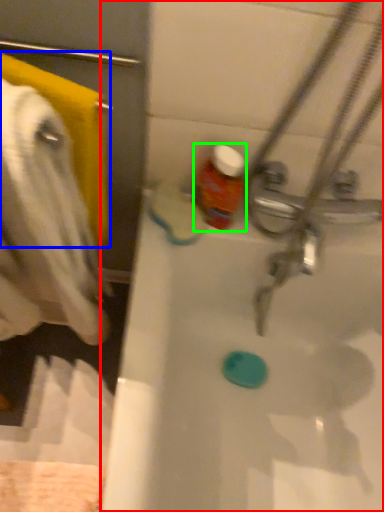
Question: Estimate the real-world distances between objects in this image. Which object is closer to bathtub (highlighted by a red box), towel/napkin (highlighted by a blue box) or bottle (highlighted by a green box)?

Choices:
 (A) towel/napkin
 (B) bottle

Answer: (B)